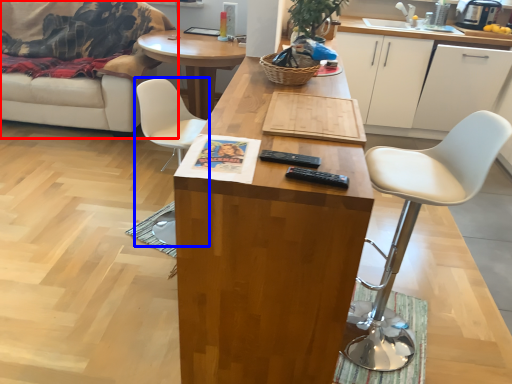
Question: Which object appears closest to the camera in this image, studio couch (highlighted by a red box) or chair (highlighted by a blue box)?

Choices:
 (A) studio couch
 (B) chair

Answer: (B)